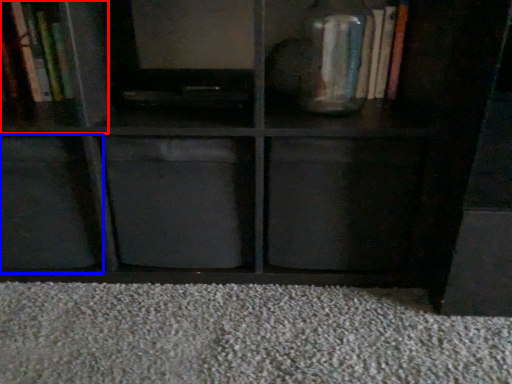
Question: Among these objects, which one is nearest to the camera, cabinet (highlighted by a red box) or cabinet (highlighted by a blue box)?

Choices:
 (A) cabinet
 (B) cabinet

Answer: (B)